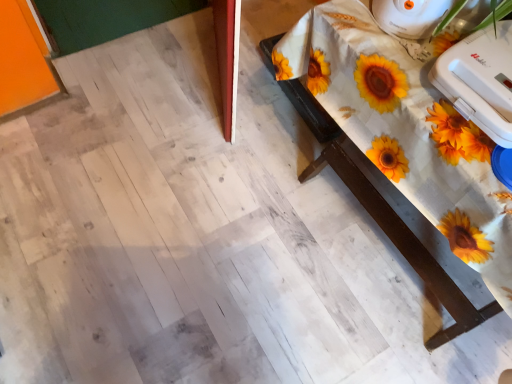
Where is `vacant space situated on the left part of white plastic toaster at upper right, arranged as the 1th appliance when ordered from the bottom`? vacant space situated on the left part of white plastic toaster at upper right, arranged as the 1th appliance when ordered from the bottom is located at coordinates (400, 71).